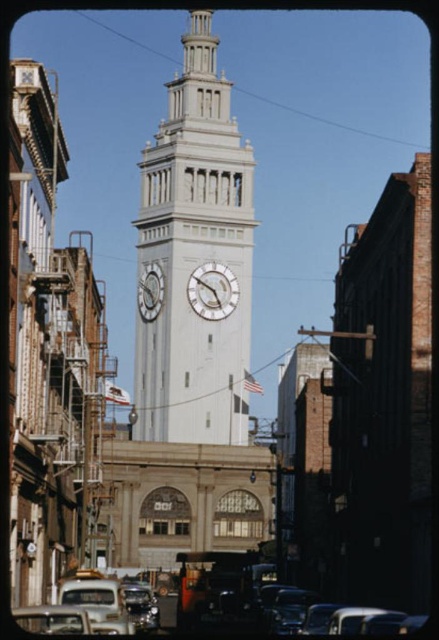
Question: Estimate the real-world distances between objects in this image. Which object is closer to the white stone clock tower at center?

Choices:
 (A) white wooden clock at center
 (B) metallic silver car at center

Answer: (A)

Question: Is the position of white stone clock tower at center more distant than that of white glossy clock at center?

Choices:
 (A) no
 (B) yes

Answer: (A)

Question: Which object appears farthest from the camera in this image?

Choices:
 (A) white glossy clock at center
 (B) white wooden clock at center

Answer: (A)

Question: Can you confirm if white stone clock tower at center is positioned to the left of white wooden clock at center?

Choices:
 (A) yes
 (B) no

Answer: (A)

Question: Can you confirm if white stone clock tower at center is positioned to the left of metallic silver car at center?

Choices:
 (A) no
 (B) yes

Answer: (B)

Question: Which is farther from the white glossy clock at center?

Choices:
 (A) white stone clock tower at center
 (B) white wooden clock at center
 (C) metallic silver car at center

Answer: (C)